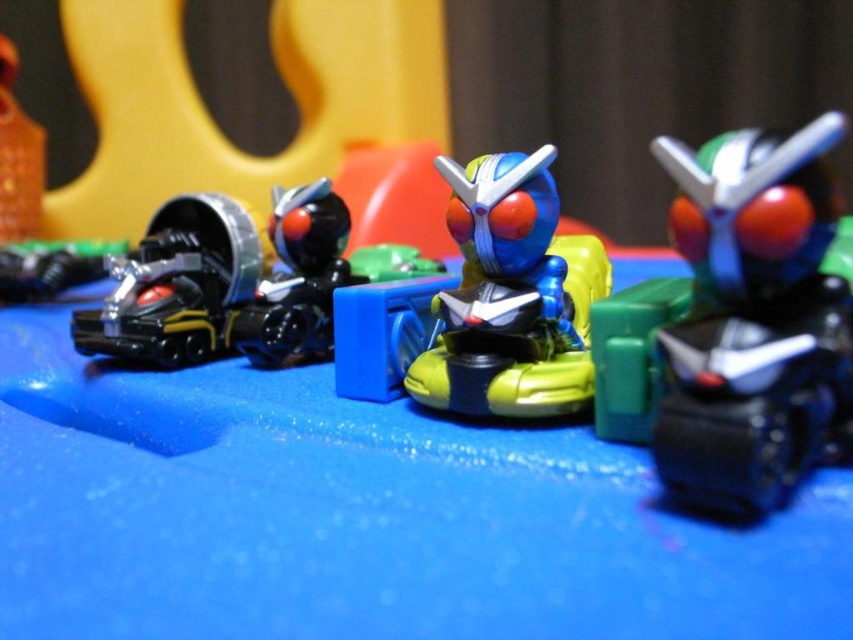
Question: Considering the real-world distances, which object is farthest from the green matte robot at right?

Choices:
 (A) shiny plastic robot at center
 (B) black plastic toy at left

Answer: (B)

Question: In this image, where is green matte robot at right located relative to shiny plastic robot at center?

Choices:
 (A) left
 (B) right

Answer: (B)

Question: Is green matte robot at right above shiny plastic robot at center?

Choices:
 (A) yes
 (B) no

Answer: (B)

Question: Among these points, which one is farthest from the camera?

Choices:
 (A) (311, 260)
 (B) (550, 289)
 (C) (740, 260)

Answer: (A)

Question: Which object appears closest to the camera in this image?

Choices:
 (A) black plastic toy at left
 (B) shiny plastic robot at center

Answer: (B)

Question: Does shiny plastic robot at center appear under black plastic toy at left?

Choices:
 (A) no
 (B) yes

Answer: (A)